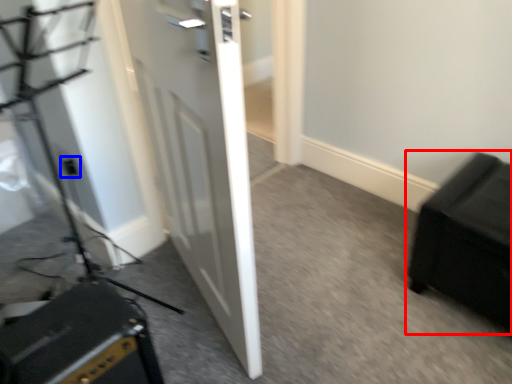
Question: Which object is closer to the camera taking this photo, furniture (highlighted by a red box) or electric outlet (highlighted by a blue box)?

Choices:
 (A) furniture
 (B) electric outlet

Answer: (A)